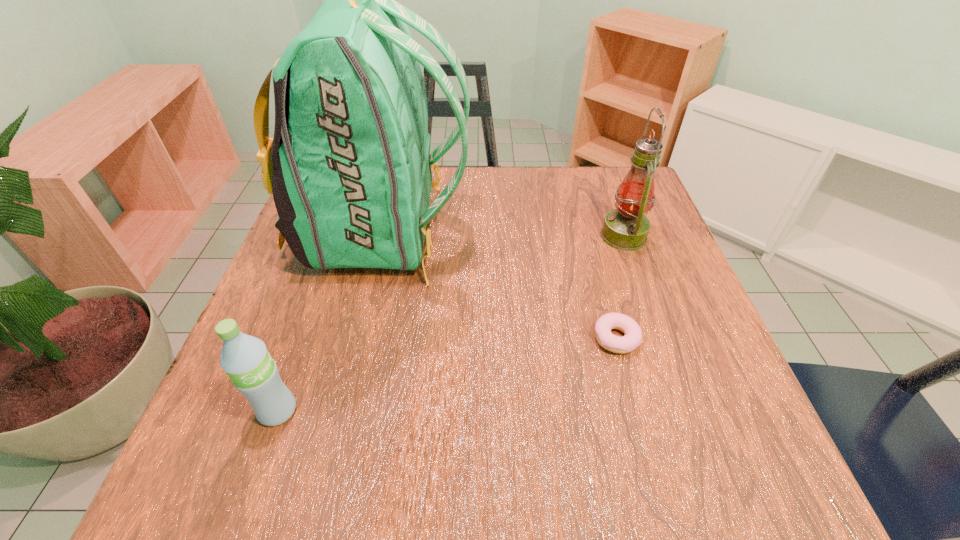
Find the location of a particular element. Image resolution: width=960 pixels, height=540 pixels. the tallest object is located at coordinates (349, 166).

At what (x,y) coordinates should I click in order to perform the action: click on oil lamp. Please return your answer as a coordinate pair (x, y). The height and width of the screenshot is (540, 960). Looking at the image, I should click on (626, 228).

Find the location of `the second shortest object`. the second shortest object is located at coordinates (245, 359).

Find the location of a particular element. The height and width of the screenshot is (540, 960). the nearest object is located at coordinates (245, 359).

The height and width of the screenshot is (540, 960). Find the location of `the second nearest object`. the second nearest object is located at coordinates (x=632, y=339).

At what (x,y) coordinates should I click in order to perform the action: click on doughnut. Please return your answer as a coordinate pair (x, y). The image size is (960, 540). Looking at the image, I should click on (632, 339).

Find the location of a particular element. free space located 0.370m on the back of the backpack is located at coordinates pos(630,233).

Find the location of a particular element. Image resolution: width=960 pixels, height=540 pixels. free space located 0.370m on the front of the oil lamp is located at coordinates (686, 412).

Image resolution: width=960 pixels, height=540 pixels. Find the location of `vacant position located on the left of the nearest object`. vacant position located on the left of the nearest object is located at coordinates (228, 410).

You are a GUI agent. You are given a task and a screenshot of the screen. Output one action in this format:
    pyautogui.click(x=<x>, y=<y>)
    Task: Click on the free location located on the front of the shortest object
    The height and width of the screenshot is (540, 960).
    Given the screenshot: What is the action you would take?
    pyautogui.click(x=652, y=473)